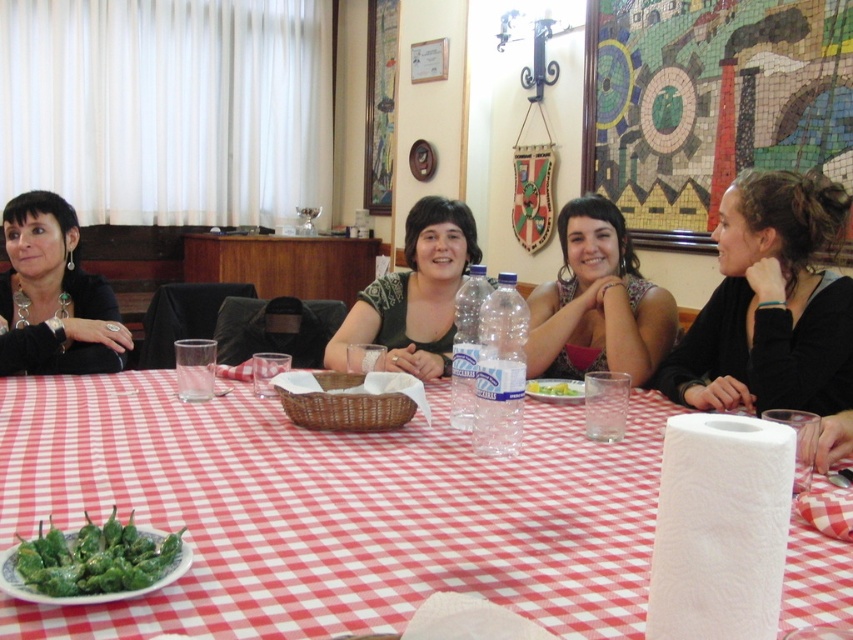
You are standing at the edge of the table in the dining scene. There are two points marked on the tablecloth, one at coordinates point (x=218, y=637) and the other at point (x=39, y=196). If you want to reach the point that is closer to you first, which coordinate should you move towards?

Point (x=218, y=637) is closer to the viewer than point (x=39, y=196), so you should move towards point (x=218, y=637) first.

You are a server at a restaurant and need to place a 70 cm wide platter on the table. The table has a red checkered tablecloth at center. Can you fit the platter on the table without it hanging over the edge?

The distance between the red checkered tablecloth at center and the viewer is 73.47 centimeters. However, this measurement indicates the depth from the viewer to the tablecloth, not the table width. Without knowing the table width, it is impossible to determine if the platter will fit. Please check the table dimensions.

You are a server at the restaurant and need to place a new order of appetizers on the table. The appetizers come in a tray that is wider than the matte black jacket at left. Will the tray fit on the table without overlapping the green glossy peppers at center?

The matte black jacket at left is wider than the green glossy peppers at center. Since the tray is wider than the matte black jacket at left, it will likely be too wide to fit on the table without overlapping the green glossy peppers at center.